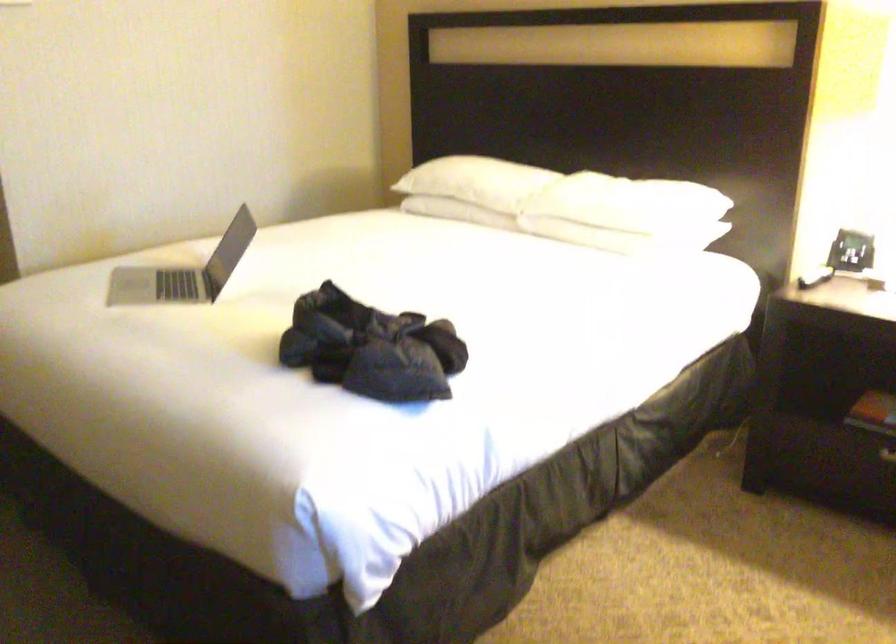
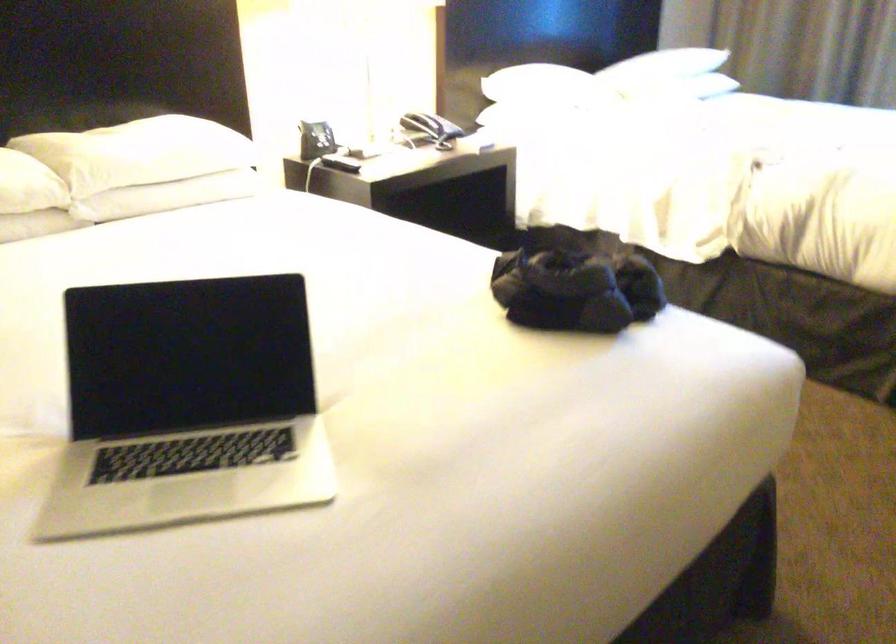
Locate, in the second image, the point that corresponds to the point at 579,229 in the first image.

(167, 196)